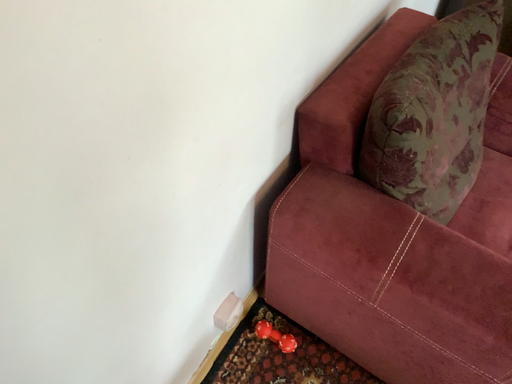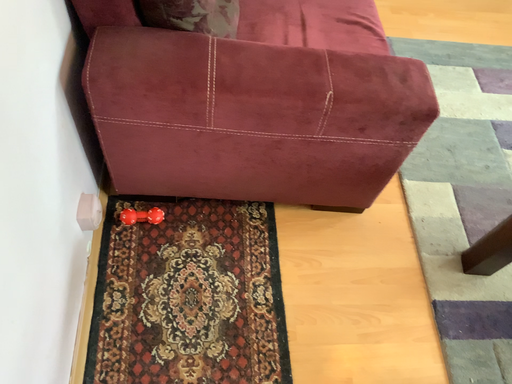
Question: How did the camera likely rotate when shooting the video?

Choices:
 (A) rotated left
 (B) rotated right

Answer: (B)